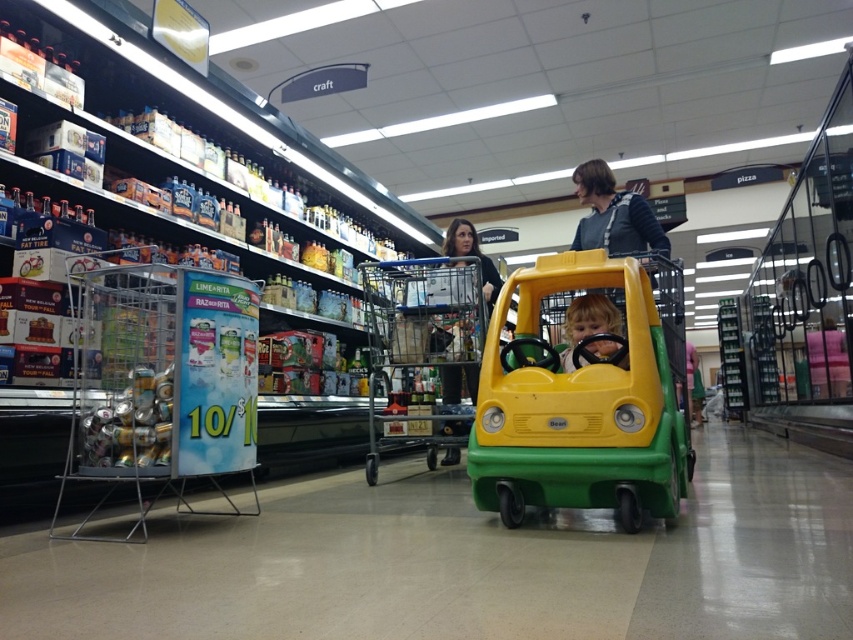
Can you confirm if matte black shirt at center is taller than smooth yellow steering wheel at center?

Correct, matte black shirt at center is much taller as smooth yellow steering wheel at center.

Can you confirm if matte black shirt at center is positioned to the right of smooth yellow steering wheel at center?

No, matte black shirt at center is not to the right of smooth yellow steering wheel at center.

Does point (485, 291) come closer to viewer compared to point (572, 353)?

No, (485, 291) is behind (572, 353).

You are a GUI agent. You are given a task and a screenshot of the screen. Output one action in this format:
    pyautogui.click(x=<x>, y=<y>)
    Task: Click on the matte black shirt at center
    The height and width of the screenshot is (640, 853).
    Given the screenshot: What is the action you would take?
    pyautogui.click(x=473, y=256)

Does point (544, 452) come behind point (486, 266)?

No, it is not.

Does green plastic toy car at center have a smaller size compared to matte black shirt at center?

Incorrect, green plastic toy car at center is not smaller in size than matte black shirt at center.

Who is more distant from viewer, [618,310] or [448,232]?

Positioned behind is point [448,232].

At what (x,y) coordinates should I click in order to perform the action: click on green plastic toy car at center. Please return your answer as a coordinate pair (x, y). Image resolution: width=853 pixels, height=640 pixels. Looking at the image, I should click on (584, 392).

Is point (402, 372) less distant than point (619, 362)?

No, (402, 372) is further to viewer.

Is the position of metallic blue trolley at center more distant than that of smooth yellow steering wheel at center?

Yes, it is.

Between point (453, 339) and point (587, 305), which one is positioned in front?

Point (587, 305) is in front.

Identify the location of metallic blue trolley at center. The image size is (853, 640). (422, 353).